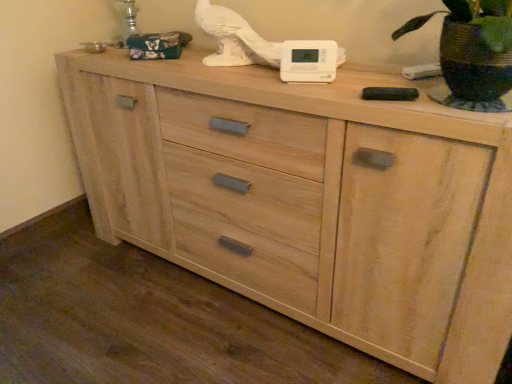
Where is `white plastic thermostat at center`? Image resolution: width=512 pixels, height=384 pixels. white plastic thermostat at center is located at coordinates (308, 61).

What do you see at coordinates (308, 61) in the screenshot? I see `white plastic thermostat at center` at bounding box center [308, 61].

Identify the location of white plastic thermostat at center. (308, 61).